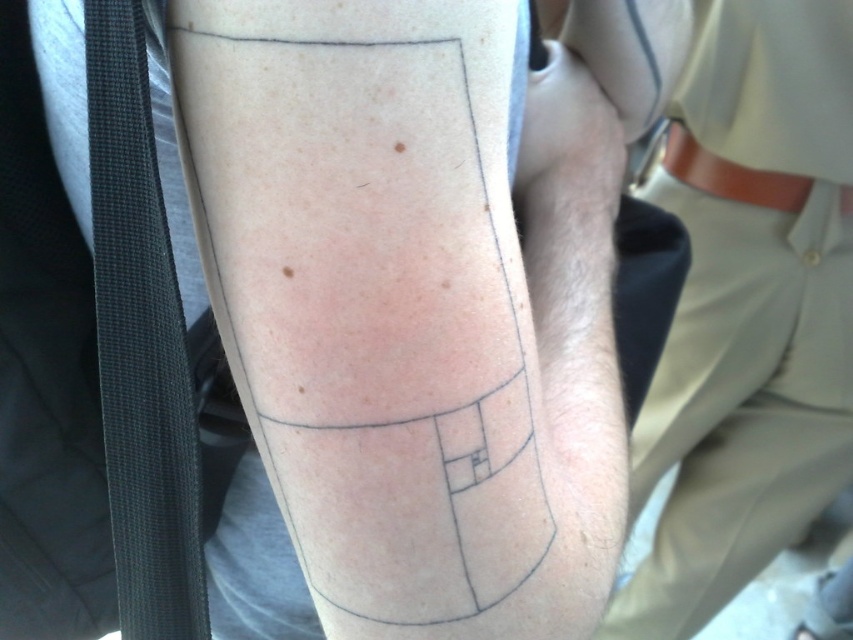
Between black ink tattoo at center and beige fabric pants at lower right, which one has more height?

beige fabric pants at lower right

Does black ink tattoo at center lie in front of beige fabric pants at lower right?

That is True.

The height and width of the screenshot is (640, 853). Describe the element at coordinates (413, 305) in the screenshot. I see `black ink tattoo at center` at that location.

At what (x,y) coordinates should I click in order to perform the action: click on black ink tattoo at center. Please return your answer as a coordinate pair (x, y). Image resolution: width=853 pixels, height=640 pixels. Looking at the image, I should click on (413, 305).